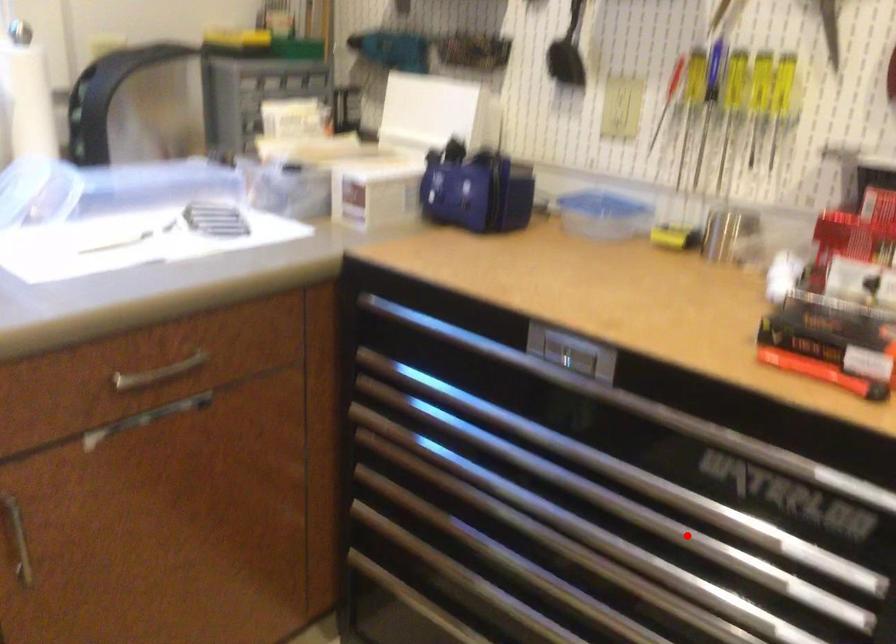
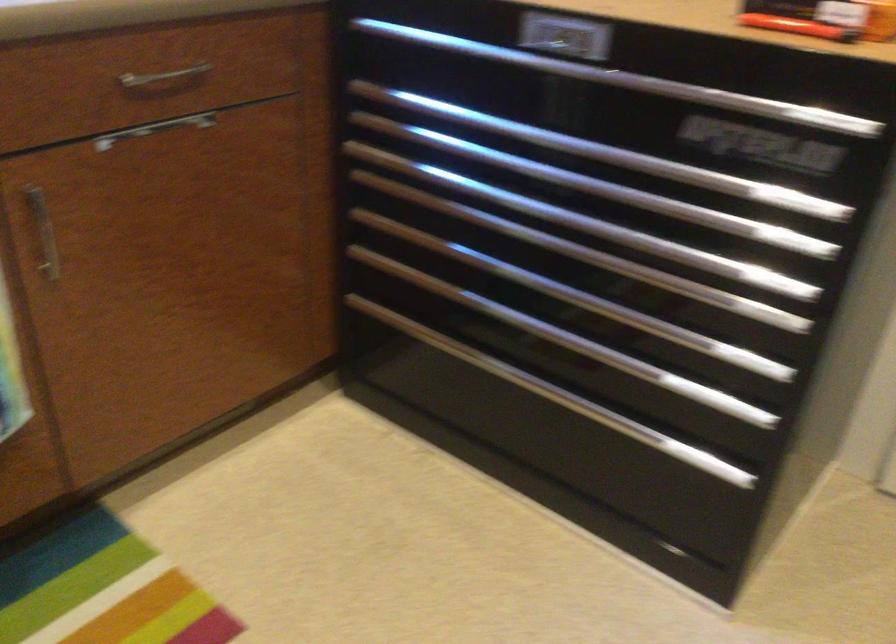
Find the pixel in the second image that matches the highlighted location in the first image.

(666, 205)